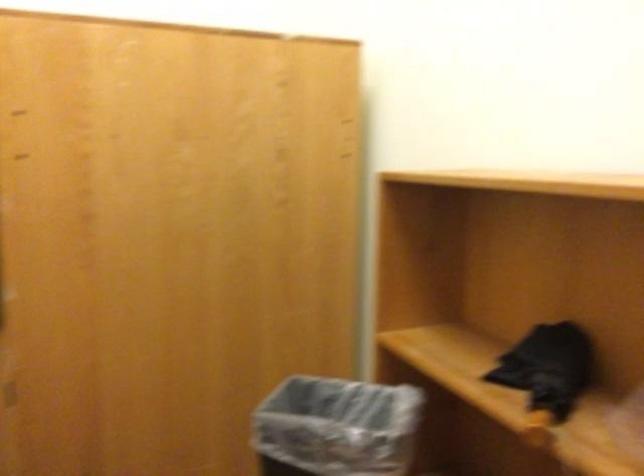
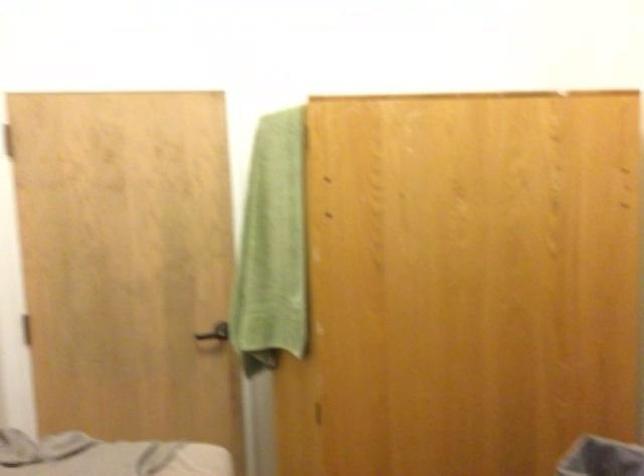
In a continuous first-person perspective shot, in which direction is the camera moving?

The cameraman moved toward left, backward.